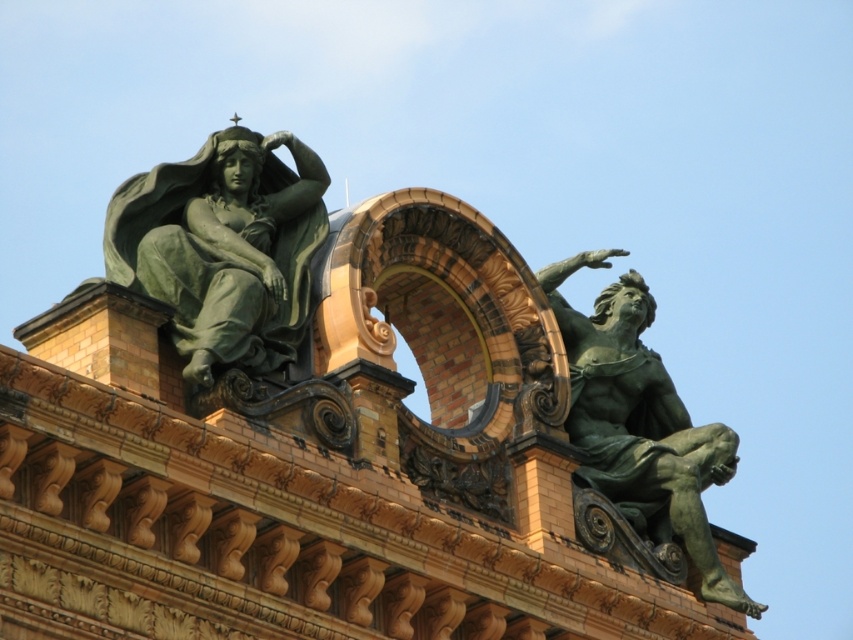
Question: Is green patina statue at upper left above green patina statue at right?

Choices:
 (A) no
 (B) yes

Answer: (B)

Question: Among these objects, which one is nearest to the camera?

Choices:
 (A) green patina statue at upper left
 (B) green patina statue at right

Answer: (A)

Question: From the image, what is the correct spatial relationship of green patina statue at upper left in relation to green patina statue at right?

Choices:
 (A) below
 (B) above

Answer: (B)

Question: Observing the image, what is the correct spatial positioning of green patina statue at upper left in reference to green patina statue at right?

Choices:
 (A) above
 (B) below

Answer: (A)